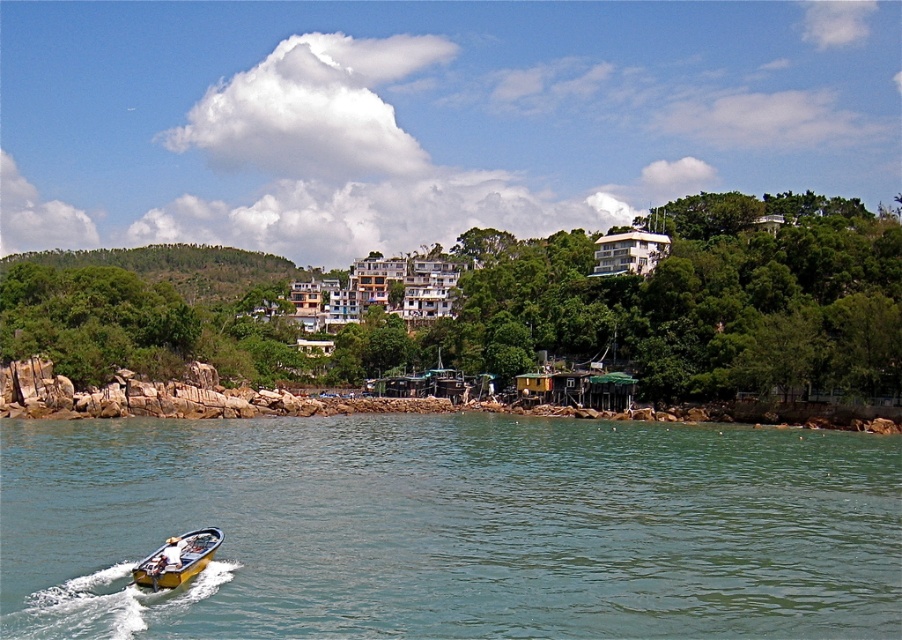
You are a drone operator trying to capture a photo of the motorboat and the colorful buildings. Your drone is currently at point A, which is at coordinates point (563, 237). You need to fly it to point B at coordinates point (205, 544) to get the best shot. However, you must ensure that the drone doesn not fly over the rocky shoreline. Based on the scene description, will moving from point A to point B require the drone to fly over the rocky shoreline?

Point (563, 237) is behind point (205, 544). Since the drone is moving from a point behind to a point in front, it would pass over the rocky shoreline area. Therefore, the drone will have to fly over the rocky shoreline when moving from point (563, 237) to point (205, 544).

You are standing at the point marked by the coordinates point (519, 307), which is the green leafy tree at lower left. You want to walk towards the small motorboat moving from left to right. Which direction should you go to reach the motorboat?

The small motorboat is moving from left to right in the foreground, so to reach it from the green leafy tree at lower left, you should walk towards the right direction.

You are a photographer planning to take a photo of the clear blue water at lower left and the green leafy tree at lower left. Based on their positions, which object would appear closer to the bottom of the photo?

The clear blue water at lower left is located below the green leafy tree at lower left, so it would appear closer to the bottom of the photo.